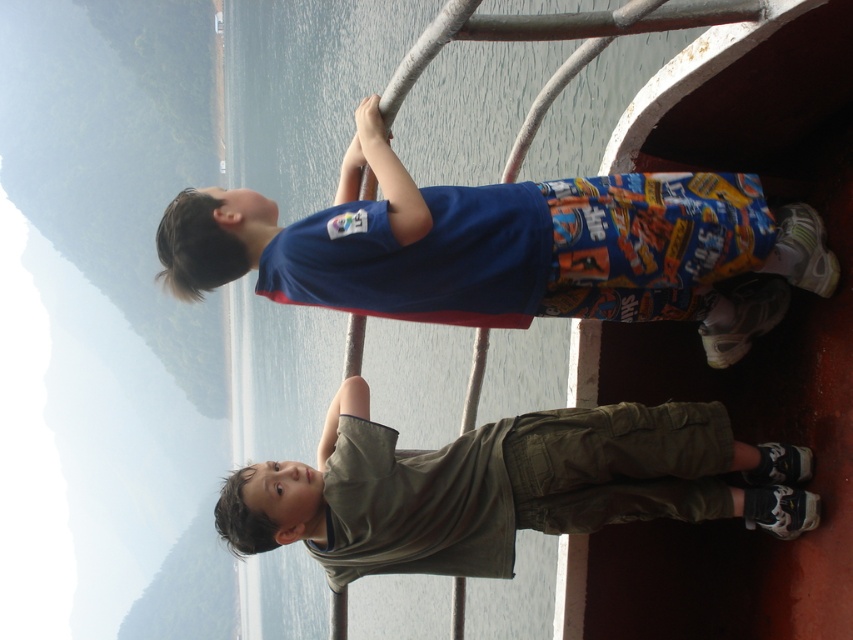
Question: Is blue cotton shirt at upper center in front of khaki cotton shirt at center?

Choices:
 (A) yes
 (B) no

Answer: (A)

Question: Which object is closer to the camera taking this photo?

Choices:
 (A) khaki cotton shirt at center
 (B) blue cotton shirt at upper center

Answer: (B)

Question: Is blue cotton shirt at upper center above khaki cotton shirt at center?

Choices:
 (A) yes
 (B) no

Answer: (A)

Question: Can you confirm if blue cotton shirt at upper center is positioned below khaki cotton shirt at center?

Choices:
 (A) no
 (B) yes

Answer: (A)

Question: Which point is closer to the camera taking this photo?

Choices:
 (A) (583, 454)
 (B) (746, 328)

Answer: (A)

Question: Among these points, which one is farthest from the camera?

Choices:
 (A) (697, 269)
 (B) (718, 502)

Answer: (B)